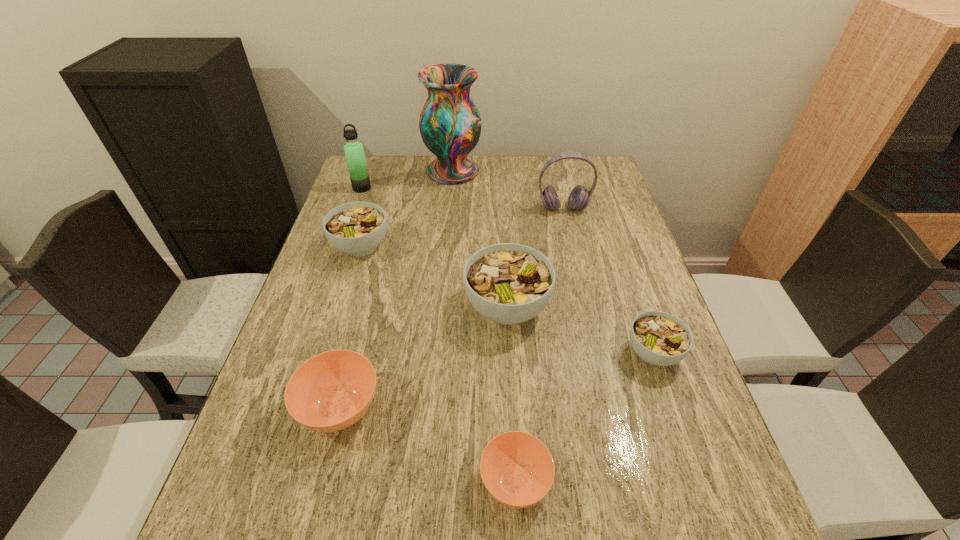
Identify the location of free space located on the right of the shortest object. (674, 481).

The image size is (960, 540). What are the coordinates of `vase positioned at the far edge` in the screenshot? It's located at (450, 124).

Where is `thermos bottle situated at the far edge`? The width and height of the screenshot is (960, 540). thermos bottle situated at the far edge is located at coordinates (354, 152).

The width and height of the screenshot is (960, 540). I want to click on thermos bottle positioned at the left edge, so click(354, 152).

What are the coordinates of `headset at the right edge` in the screenshot? It's located at (579, 198).

You are a GUI agent. You are given a task and a screenshot of the screen. Output one action in this format:
    pyautogui.click(x=<x>, y=<y>)
    Task: Click on the soup bowl positioned at the right edge
    
    Given the screenshot: What is the action you would take?
    pyautogui.click(x=659, y=338)

The width and height of the screenshot is (960, 540). Identify the location of object present at the far left corner. (354, 152).

At what (x,y) coordinates should I click in order to perform the action: click on vacant area at the far edge of the desktop. Please return your answer as a coordinate pair (x, y). The image size is (960, 540). Looking at the image, I should click on (413, 177).

Where is `vacant space at the left edge of the desktop`? vacant space at the left edge of the desktop is located at coordinates (329, 257).

This screenshot has height=540, width=960. In the image, there is a desktop. Identify the location of vacant space at the right edge. click(591, 261).